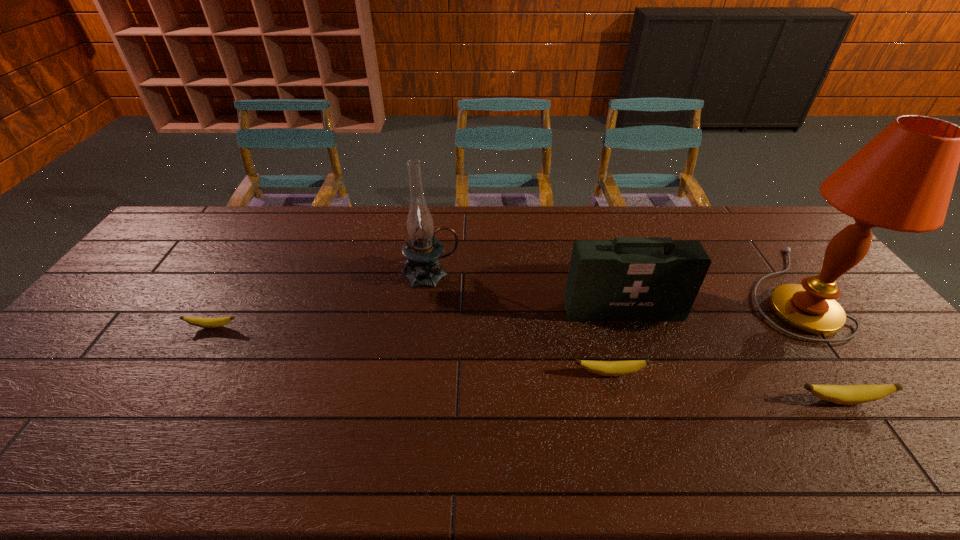
Where is `vacant space situated 0.230m on the right of the leftmost banana`? vacant space situated 0.230m on the right of the leftmost banana is located at coordinates (322, 327).

Where is `vacant space located on the back of the second banana from right to left`? The image size is (960, 540). vacant space located on the back of the second banana from right to left is located at coordinates pyautogui.click(x=588, y=292).

Where is `vacant space situated on the back of the fourth tallest object`? vacant space situated on the back of the fourth tallest object is located at coordinates (811, 357).

Find the location of a particular element. The width and height of the screenshot is (960, 540). vacant space located on the back of the oil lamp is located at coordinates (438, 220).

Where is `free space located 0.260m on the left of the tallest object`? free space located 0.260m on the left of the tallest object is located at coordinates (659, 291).

The height and width of the screenshot is (540, 960). What are the coordinates of `vacant space situated on the front-facing side of the first-aid kit` in the screenshot? It's located at (648, 388).

The width and height of the screenshot is (960, 540). I want to click on object located at the near edge, so click(x=840, y=394).

Locate an element on the screen. This screenshot has width=960, height=540. banana present at the right edge is located at coordinates (840, 394).

Locate an element on the screen. This screenshot has height=540, width=960. lamp that is at the right edge is located at coordinates (902, 180).

Find the location of a particular element. This screenshot has width=960, height=540. object that is at the near right corner is located at coordinates (840, 394).